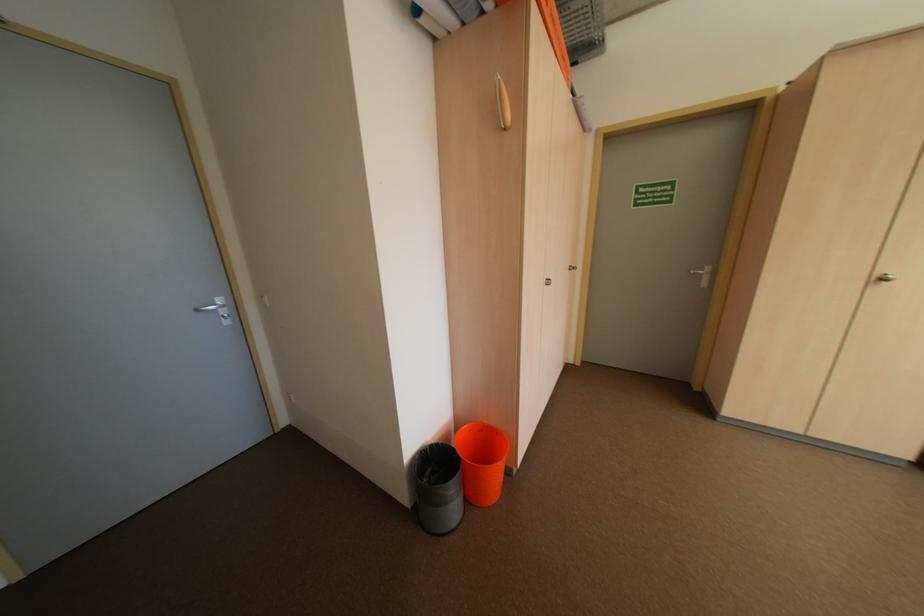
Find where to pull the wooden cabinet handle. Please return your answer as a coordinate pair (x, y).

(503, 102)